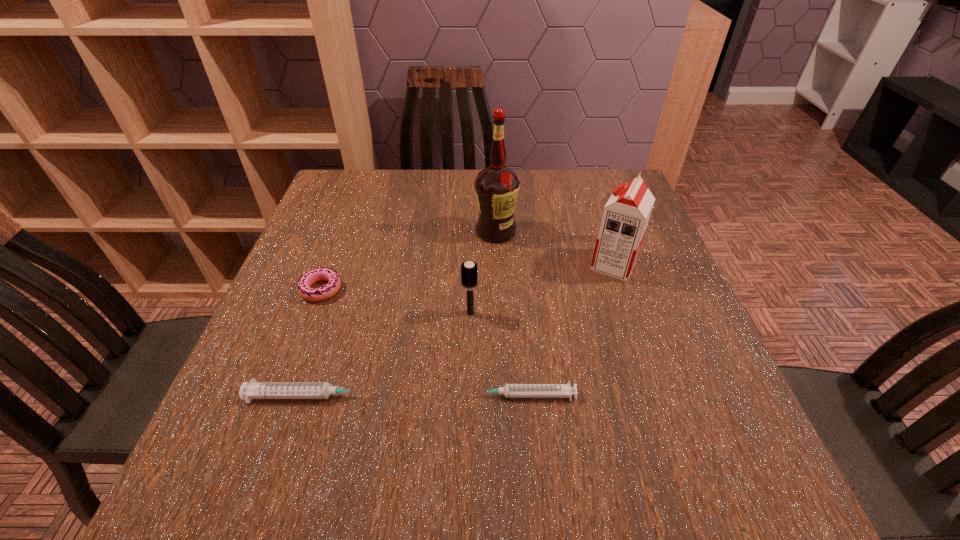
You are a GUI agent. You are given a task and a screenshot of the screen. Output one action in this format:
    pyautogui.click(x=<x>, y=<y>)
    Task: Click on the object at the near left corner
    This screenshot has width=960, height=540.
    Given the screenshot: What is the action you would take?
    pyautogui.click(x=253, y=390)

Where is `free location at the far edge`? The image size is (960, 540). free location at the far edge is located at coordinates (396, 210).

The image size is (960, 540). Identify the location of vacant space at the near edge. (414, 426).

Identify the location of vacant space at the left edge. This screenshot has height=540, width=960. (299, 312).

What are the coordinates of `vacant space at the right edge of the desktop` in the screenshot? It's located at (595, 237).

Locate an element on the screen. This screenshot has height=540, width=960. vacant space at the near left corner of the desktop is located at coordinates (221, 433).

The width and height of the screenshot is (960, 540). I want to click on vacant area that lies between the right syringe and the taller syringe, so click(x=416, y=396).

What are the coordinates of `empty space that is in between the farthest object and the rightmost object` in the screenshot? It's located at (555, 248).

This screenshot has width=960, height=540. Identify the location of free space between the tallest object and the taller syringe. (403, 314).

This screenshot has width=960, height=540. I want to click on vacant region between the shorter syringe and the second tallest object, so click(x=568, y=330).